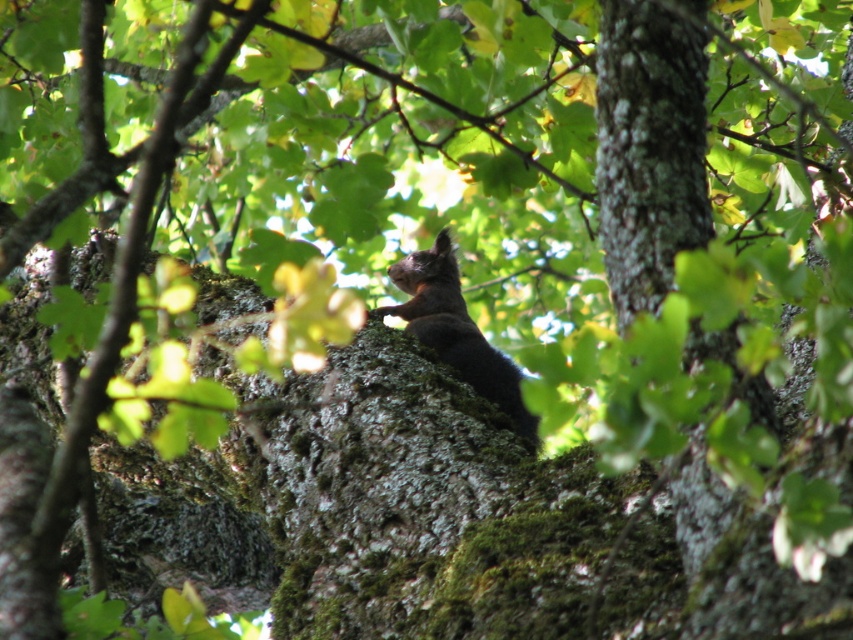
Is green mossy bark at center taller than shiny brown fur at center?

Correct, green mossy bark at center is much taller as shiny brown fur at center.

Is green mossy bark at center bigger than shiny brown fur at center?

No, green mossy bark at center is not bigger than shiny brown fur at center.

Identify the location of green mossy bark at center. The width and height of the screenshot is (853, 640). (648, 148).